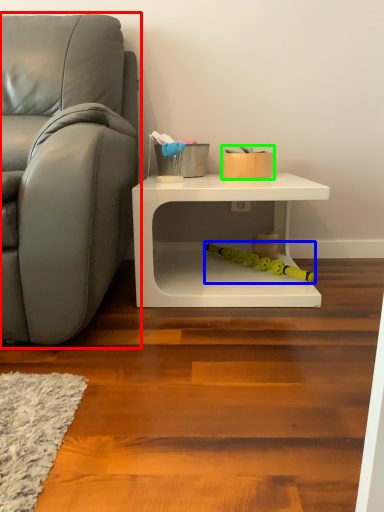
Question: Considering the real-world distances, which object is farthest from studio couch (highlighted by a red box)? toy (highlighted by a blue box) or toy (highlighted by a green box)?

Choices:
 (A) toy
 (B) toy

Answer: (A)